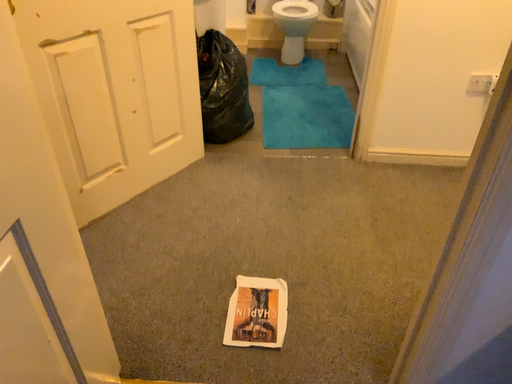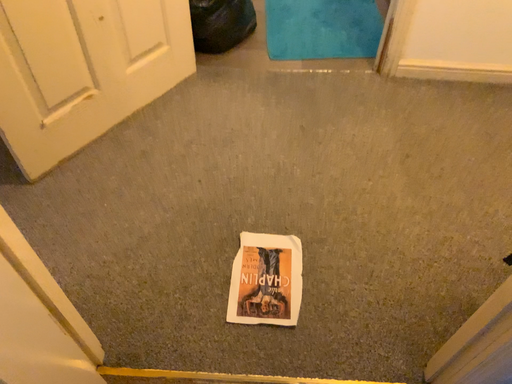
Question: How did the camera likely rotate when shooting the video?

Choices:
 (A) rotated downward
 (B) rotated upward

Answer: (A)